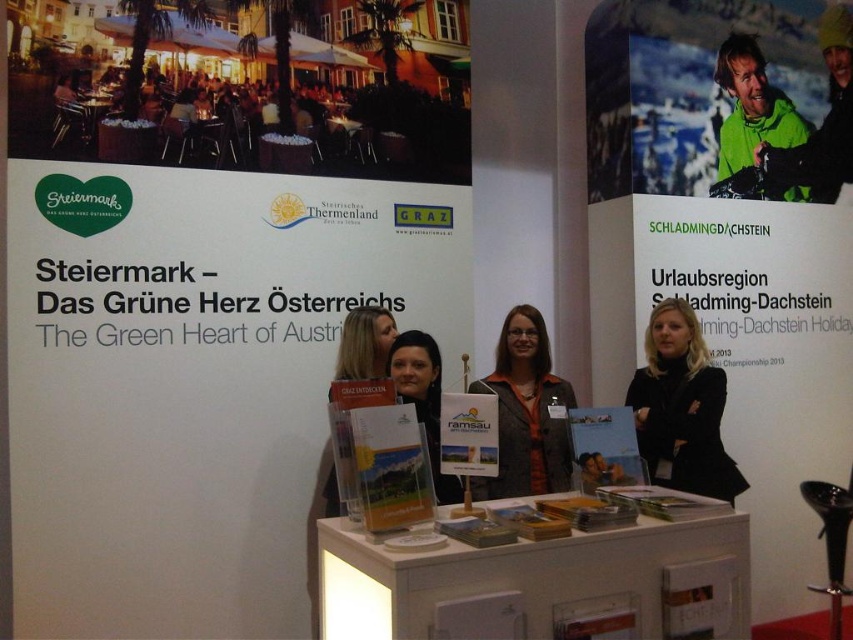
Does point (733, 83) come closer to viewer compared to point (416, 340)?

No, it is behind (416, 340).

Where is `green matte jacket at upper right`? Image resolution: width=853 pixels, height=640 pixels. green matte jacket at upper right is located at coordinates (751, 106).

Does point (120, 621) come in front of point (726, 145)?

Yes, point (120, 621) is closer to viewer.

Who is positioned more to the left, white paperboard at center or green matte jacket at upper right?

Positioned to the left is white paperboard at center.

This screenshot has width=853, height=640. Find the location of `white paperboard at center`. white paperboard at center is located at coordinates (193, 380).

Is black fabric at center to the right of green matte jacket at upper right from the viewer's perspective?

Incorrect, black fabric at center is not on the right side of green matte jacket at upper right.

Can you confirm if black fabric at center is positioned above green matte jacket at upper right?

No, black fabric at center is not above green matte jacket at upper right.

Who is more forward, (718, 381) or (724, 177)?

Point (718, 381) is more forward.

The image size is (853, 640). I want to click on black fabric at center, so click(682, 406).